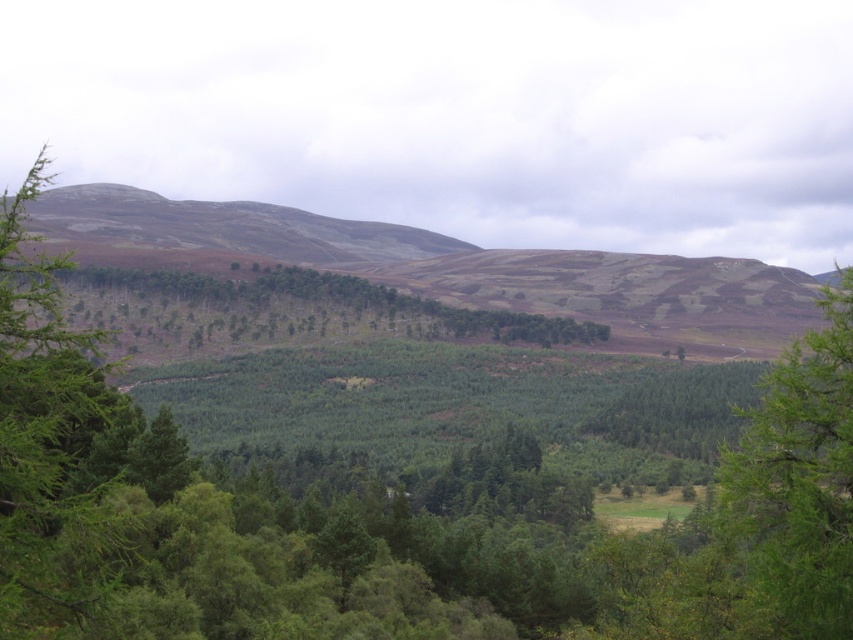
Question: Considering the real-world distances, which object is closest to the green matte tree at left?

Choices:
 (A) green leafy tree at right
 (B) earthy brown grassland at upper left

Answer: (A)

Question: Which point is farther from the camera taking this photo?

Choices:
 (A) (838, 317)
 (B) (361, 256)
 (C) (105, 566)

Answer: (B)

Question: Which point is closer to the camera?

Choices:
 (A) green textured trees at center
 (B) green matte tree at left
 (C) earthy brown grassland at upper left
 (D) green leafy tree at right

Answer: (B)

Question: Observing the image, what is the correct spatial positioning of green leafy tree at right in reference to earthy brown grassland at upper left?

Choices:
 (A) left
 (B) right

Answer: (B)

Question: Is green matte tree at left smaller than green textured trees at center?

Choices:
 (A) yes
 (B) no

Answer: (A)

Question: Is green leafy tree at right closer to camera compared to green textured trees at center?

Choices:
 (A) yes
 (B) no

Answer: (B)